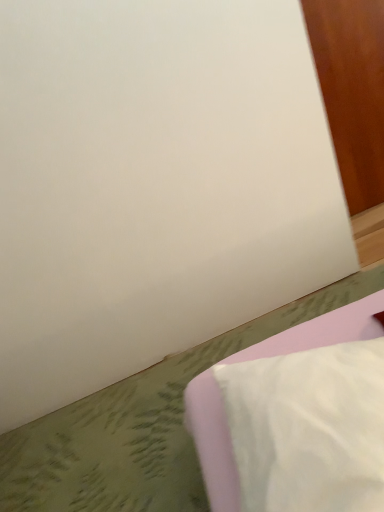
Locate an element on the screen. This screenshot has width=384, height=512. white fabric pillow at lower right is located at coordinates (212, 442).

This screenshot has width=384, height=512. Describe the element at coordinates (212, 442) in the screenshot. I see `white fabric pillow at lower right` at that location.

At what (x,y) coordinates should I click in order to perform the action: click on white fabric pillow at lower right. Please return your answer as a coordinate pair (x, y). This screenshot has height=512, width=384. Looking at the image, I should click on (212, 442).